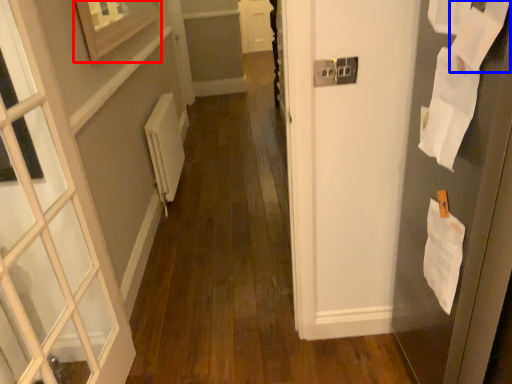
Question: Among these objects, which one is nearest to the camera, picture frame (highlighted by a red box) or paper (highlighted by a blue box)?

Choices:
 (A) picture frame
 (B) paper

Answer: (B)